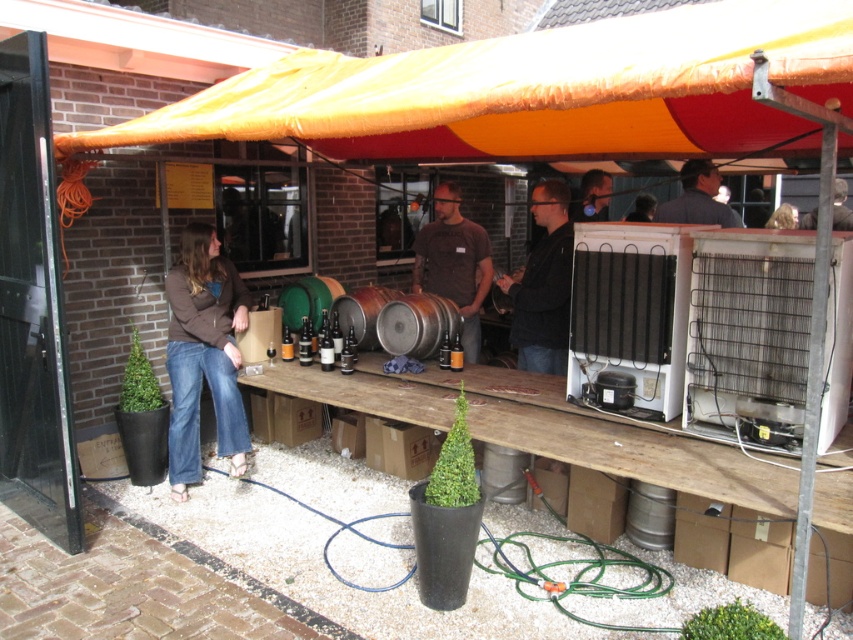
Question: Does black matte jacket at center appear over matte black jacket at center?

Choices:
 (A) yes
 (B) no

Answer: (B)

Question: Is brown denim jeans at lower left further to camera compared to matte black jacket at center?

Choices:
 (A) yes
 (B) no

Answer: (B)

Question: Which point is closer to the camera?

Choices:
 (A) (439, 262)
 (B) (225, 374)
 (C) (579, 186)

Answer: (B)

Question: Which object appears farthest from the camera in this image?

Choices:
 (A) brown denim jeans at lower left
 (B) brown fabric shirt at center
 (C) matte black jacket at center

Answer: (B)

Question: Which object is positioned closest to the brown fabric shirt at center?

Choices:
 (A) dark blue shirt at upper right
 (B) black matte jacket at center

Answer: (B)

Question: Does brown denim jeans at lower left have a smaller size compared to black matte jacket at center?

Choices:
 (A) no
 (B) yes

Answer: (A)